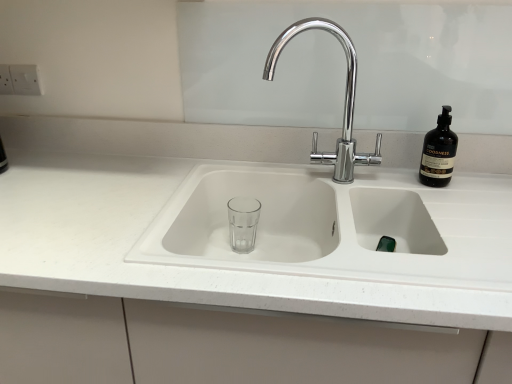
Locate an element on the screen. This screenshot has height=384, width=512. free space between chrome/metallic faucet at center and dark brown glass bottle at upper right is located at coordinates (395, 179).